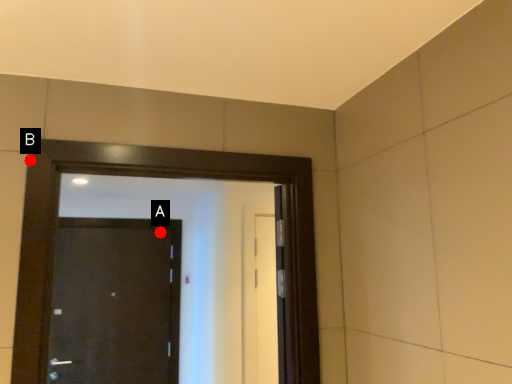
Question: Two points are circled on the image, labeled by A and B beside each circle. Which point is further to the camera?

Choices:
 (A) A is further
 (B) B is further

Answer: (A)